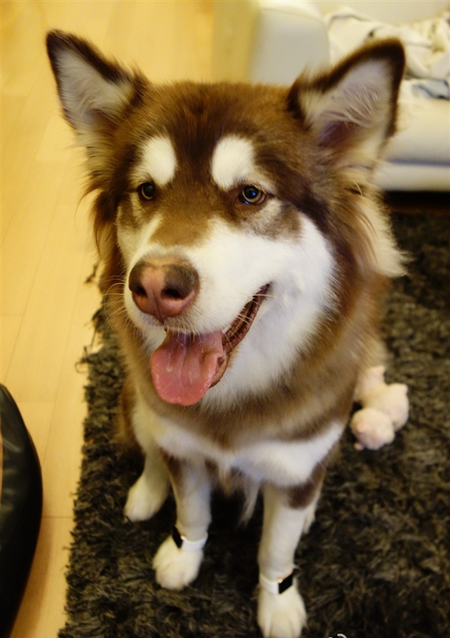
This screenshot has width=450, height=638. I want to click on 1 wooden floor, so click(42, 577).